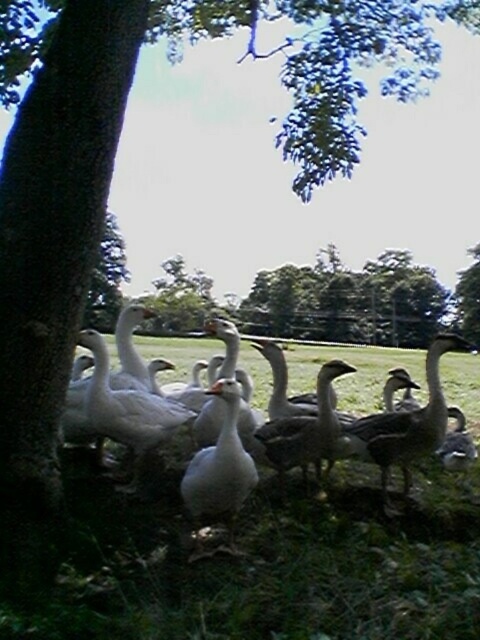
Question: From the image, what is the correct spatial relationship of white feathered goose at left in relation to gray matte duck at center?

Choices:
 (A) above
 (B) below

Answer: (A)

Question: Among these objects, which one is farthest from the camera?

Choices:
 (A) dark gray duck at center
 (B) white matte duck at left
 (C) green leafy tree at upper center

Answer: (C)

Question: Is white matte duck at center smaller than dark gray duck at center?

Choices:
 (A) no
 (B) yes

Answer: (A)

Question: Which object is closer to the camera taking this photo?

Choices:
 (A) white feathered goose at left
 (B) gray matte duck at center
 (C) green leafy tree at upper center
 (D) dark gray duck at center

Answer: (A)

Question: Which point is closer to the camera?

Choices:
 (A) white matte duck at center
 (B) white matte duck at left
 (C) green leafy tree at upper center

Answer: (A)

Question: Can you confirm if white feathered goose at left is positioned to the left of dark gray duck at center?

Choices:
 (A) no
 (B) yes

Answer: (B)